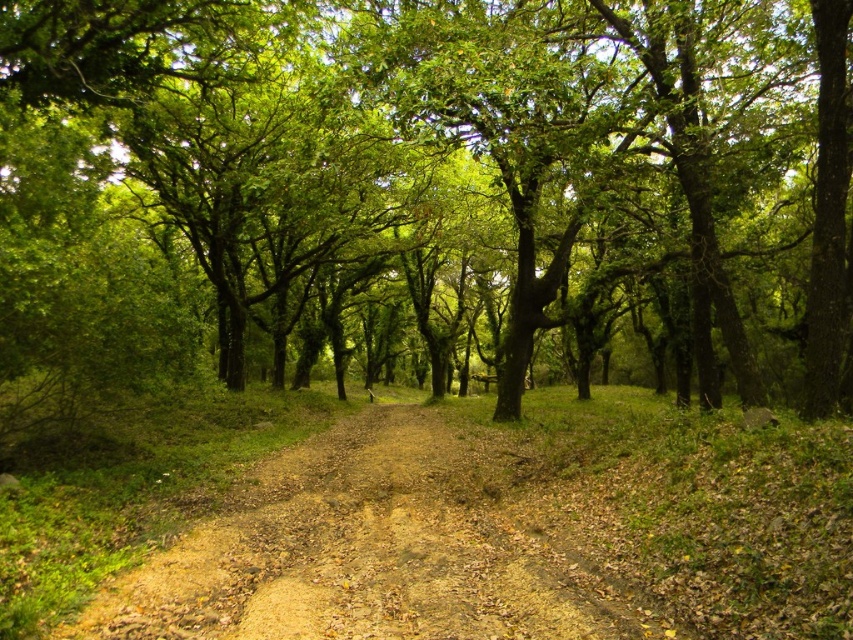
You are a hiker with a 2.5 meter wide tent. You want to set up camp along the brown dirt track at center. Considering the green leafy tree at center, will there be enough space to place your tent without cutting down any trees?

The green leafy tree at center has a larger width than the brown dirt track at center. Since the tree is wider than the track, the track itself may not be wide enough to accommodate a 2.5 meter wide tent without encroaching into the tree area. It might be challenging to set up the tent without disturbing the tree or its surrounding space.

You are a hiker carrying a 10 feet long ladder. You need to place it between the green leafy tree at center and the brown dirt track at center. Is there enough space to place the ladder horizontally between them?

The distance between the green leafy tree at center and the brown dirt track at center is 32.30 feet, which is more than enough to place a 10 feet long ladder horizontally between them.